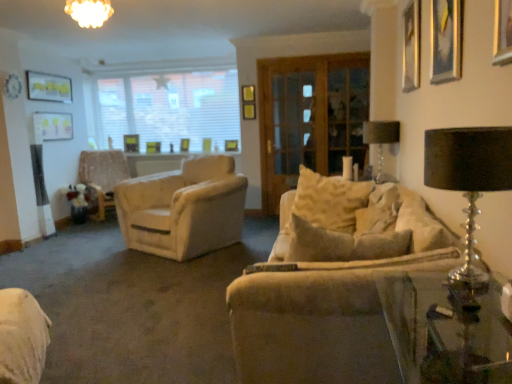
Question: From a real-world perspective, does white blinds at upper center sit lower than metallic gold picture frame at upper right, which is the fifth picture frame from back to front?

Choices:
 (A) yes
 (B) no

Answer: (A)

Question: Is white blinds at upper center facing towards metallic gold picture frame at upper right, which is the fifth picture frame from back to front?

Choices:
 (A) yes
 (B) no

Answer: (A)

Question: From the image's perspective, is white blinds at upper center below metallic gold picture frame at upper right, placed as the fourth picture frame when sorted from left to right?

Choices:
 (A) yes
 (B) no

Answer: (B)

Question: Would you say white blinds at upper center is outside metallic gold picture frame at upper right, which appears as the first picture frame when viewed from the front?

Choices:
 (A) no
 (B) yes

Answer: (B)

Question: Can you confirm if white blinds at upper center is positioned to the left of metallic gold picture frame at upper right, which appears as the first picture frame when viewed from the front?

Choices:
 (A) yes
 (B) no

Answer: (A)

Question: Can you confirm if white blinds at upper center is wider than metallic gold picture frame at upper right, placed as the fourth picture frame when sorted from left to right?

Choices:
 (A) no
 (B) yes

Answer: (A)

Question: From the image's perspective, is metallic gold picture frame at upper right, which is the fifth picture frame from back to front, over light beige fabric armchair at left?

Choices:
 (A) no
 (B) yes

Answer: (B)

Question: From a real-world perspective, is metallic gold picture frame at upper right, which appears as the first picture frame when viewed from the front, on top of light beige fabric armchair at left?

Choices:
 (A) no
 (B) yes

Answer: (B)

Question: Does metallic gold picture frame at upper right, placed as the fourth picture frame when sorted from left to right, have a smaller size compared to light beige fabric armchair at left?

Choices:
 (A) yes
 (B) no

Answer: (A)

Question: Considering the relative positions of metallic gold picture frame at upper right, which appears as the first picture frame when viewed from the front, and light beige fabric armchair at left in the image provided, is metallic gold picture frame at upper right, which appears as the first picture frame when viewed from the front, in front of light beige fabric armchair at left?

Choices:
 (A) no
 (B) yes

Answer: (B)

Question: Is metallic gold picture frame at upper right, which appears as the first picture frame when viewed from the front, with light beige fabric armchair at left?

Choices:
 (A) yes
 (B) no

Answer: (B)

Question: Is light beige fabric armchair at left a part of metallic gold picture frame at upper right, which appears as the second picture frame when viewed from the right?

Choices:
 (A) no
 (B) yes

Answer: (A)

Question: Considering the relative sizes of gold metallic picture frame at upper left, positioned as the first picture frame in left-to-right order, and white blinds at upper center in the image provided, is gold metallic picture frame at upper left, positioned as the first picture frame in left-to-right order, smaller than white blinds at upper center?

Choices:
 (A) no
 (B) yes

Answer: (B)